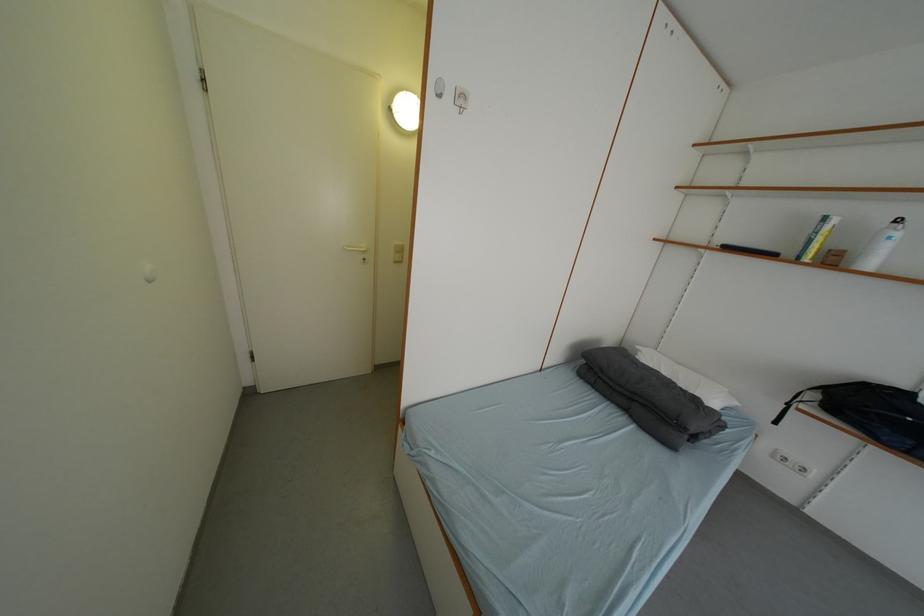
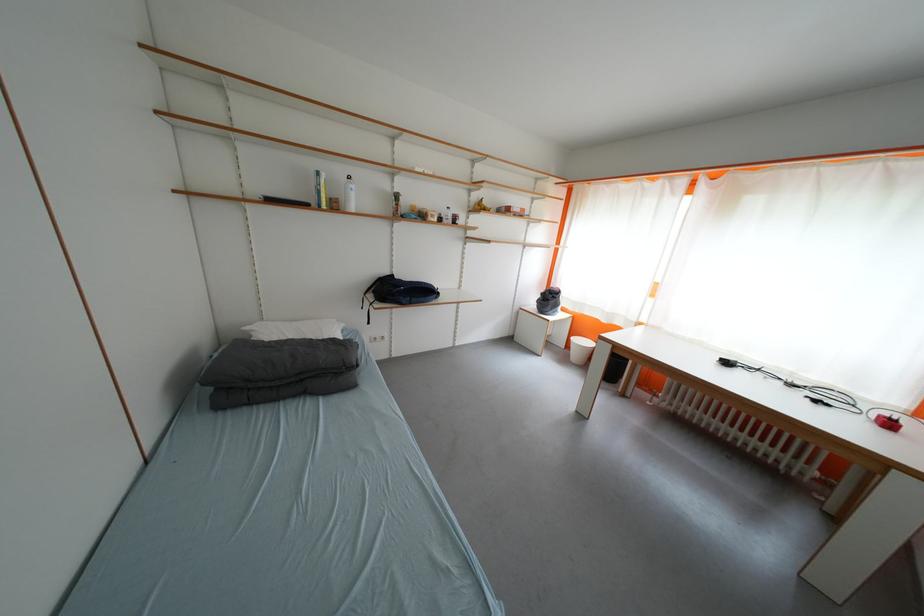
Where in the second image is the point corresponding to point 842,264 from the first image?

(344, 209)